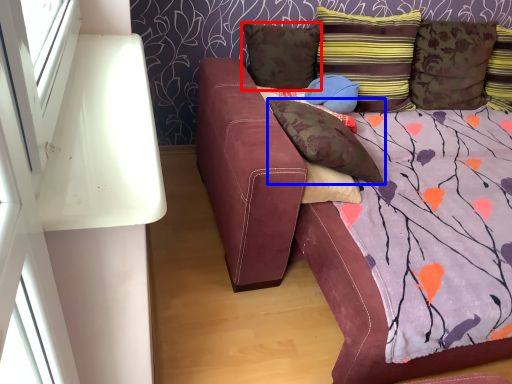
Question: Which point is further to the camera, pillow (highlighted by a red box) or pillow (highlighted by a blue box)?

Choices:
 (A) pillow
 (B) pillow

Answer: (A)